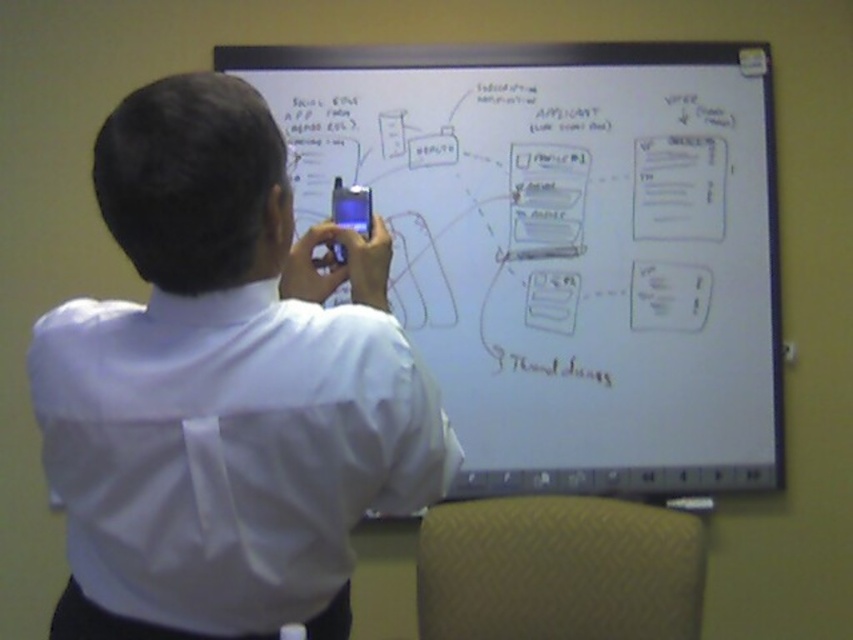
You are a photographer trying to capture the whiteboard at upper center and the white smooth shirt at upper left in a single shot. Based on their positions, can you fit both into the frame without moving the camera?

The whiteboard at upper center is located above the white smooth shirt at upper left, so yes, both can be captured in a single frame as they are positioned vertically aligned.

You are trying to take a photo of the whiteboard at upper center and the white smooth shirt at upper left. Which object should you focus on first if you want to capture both in one frame without moving your camera?

The whiteboard at upper center has a larger size compared to the white smooth shirt at upper left, so you should focus on the whiteboard at upper center first to ensure it fits properly in the frame before adjusting for the smaller object.